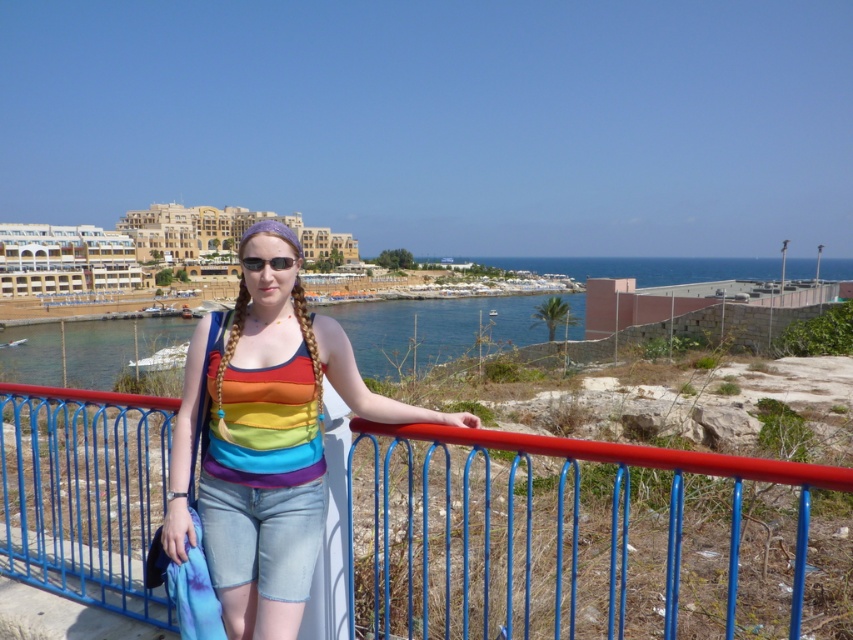
Is blue metal fence at center above black plastic sunglasses at center?

No, blue metal fence at center is not above black plastic sunglasses at center.

Can you confirm if blue metal fence at center is positioned to the left of black plastic sunglasses at center?

No, blue metal fence at center is not to the left of black plastic sunglasses at center.

You are a GUI agent. You are given a task and a screenshot of the screen. Output one action in this format:
    pyautogui.click(x=<x>, y=<y>)
    Task: Click on the blue metal fence at center
    
    Given the screenshot: What is the action you would take?
    click(x=553, y=536)

Who is more distant from viewer, (636, 468) or (252, 540)?

The point (636, 468) is behind.

Between blue metal fence at center and rainbow fabric tank top at center, which one is positioned lower?

blue metal fence at center is lower down.

Describe the element at coordinates (553, 536) in the screenshot. I see `blue metal fence at center` at that location.

Locate an element on the screen. The width and height of the screenshot is (853, 640). blue metal fence at center is located at coordinates (553, 536).

Between point (231, 518) and point (273, 268), which one is positioned behind?

Point (273, 268)

The image size is (853, 640). Find the location of `rainbow fabric tank top at center`. rainbow fabric tank top at center is located at coordinates (265, 440).